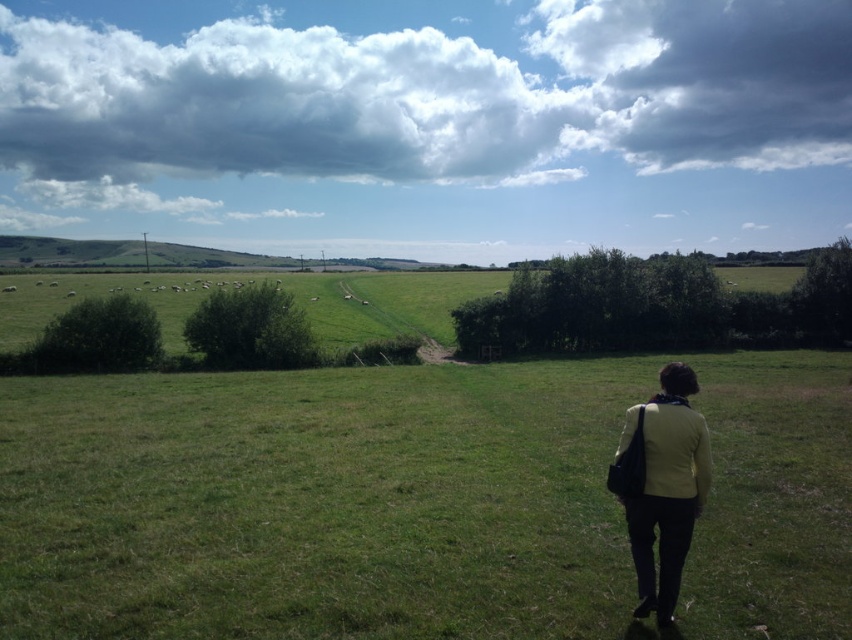
You are a photographer trying to capture the entire scene in one shot. Given that the green grassy field at center and the cloudy sky at upper center are both in view, which one will occupy less space in your photo?

The green grassy field at center has a smaller size compared to cloudy sky at upper center, so it will occupy less space in the photo.

You are a photographer trying to capture a landscape shot of the green grassy field at center and the light yellow fabric jacket at lower right. Since you want both elements to be clearly visible in the photo, which object should you focus on first to ensure proper depth of field?

The green grassy field at center should be focused on first because it has a greater height compared to the light yellow fabric jacket at lower right, ensuring both are in focus when using depth of field techniques.